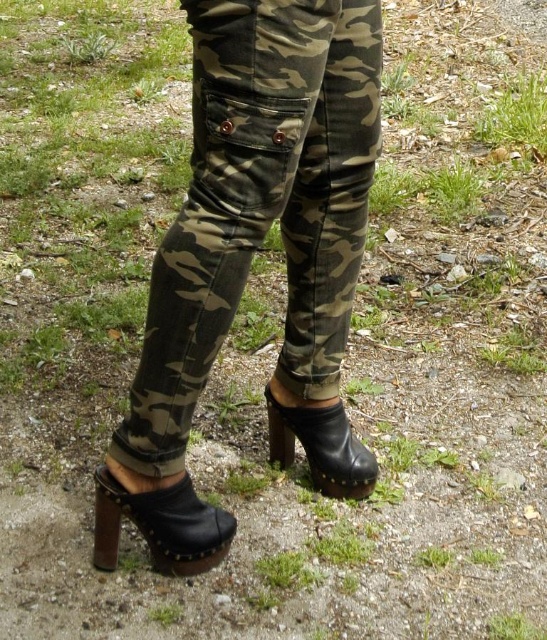
Question: Estimate the real-world distances between objects in this image. Which object is farther from the black leather sandal at lower left?

Choices:
 (A) black leather boot at lower center
 (B) camo fabric pants at center

Answer: (B)

Question: Is camo fabric pants at center bigger than black leather sandal at lower left?

Choices:
 (A) no
 (B) yes

Answer: (B)

Question: Considering the real-world distances, which object is closest to the black leather boot at lower center?

Choices:
 (A) camo fabric pants at center
 (B) black leather sandal at lower left

Answer: (A)

Question: Observing the image, what is the correct spatial positioning of camo fabric pants at center in reference to black leather boot at lower center?

Choices:
 (A) left
 (B) right

Answer: (A)

Question: Does camo fabric pants at center appear on the right side of black leather sandal at lower left?

Choices:
 (A) yes
 (B) no

Answer: (A)

Question: Which object appears farthest from the camera in this image?

Choices:
 (A) black leather sandal at lower left
 (B) black leather boot at lower center

Answer: (B)